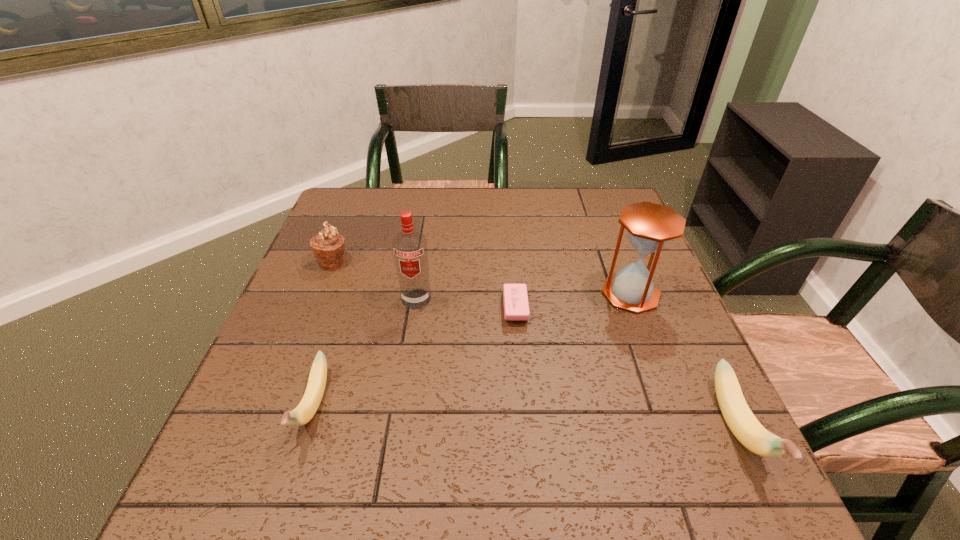
This screenshot has width=960, height=540. Identify the location of the left banana. (303, 413).

Where is `the shorter banana`? This screenshot has height=540, width=960. the shorter banana is located at coordinates (303, 413).

At what (x,y) coordinates should I click in order to perform the action: click on the right banana. Please return your answer as a coordinate pair (x, y). This screenshot has height=540, width=960. Looking at the image, I should click on (743, 424).

Where is `the taller banana`? The height and width of the screenshot is (540, 960). the taller banana is located at coordinates (743, 424).

This screenshot has height=540, width=960. Find the location of `the leftmost object`. the leftmost object is located at coordinates (328, 246).

At what (x,y) coordinates should I click in order to perform the action: click on muffin. Please return your answer as a coordinate pair (x, y). The height and width of the screenshot is (540, 960). Looking at the image, I should click on (328, 246).

At what (x,y) coordinates should I click in order to perform the action: click on the shortest object. Please return your answer as a coordinate pair (x, y). Looking at the image, I should click on (516, 308).

This screenshot has width=960, height=540. Find the location of `the third object from right to left`. the third object from right to left is located at coordinates (516, 308).

The width and height of the screenshot is (960, 540). I want to click on hourglass, so click(650, 226).

Image resolution: width=960 pixels, height=540 pixels. I want to click on the fourth object from right to left, so click(x=410, y=251).